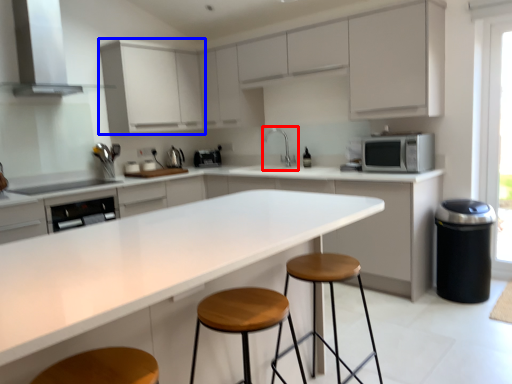
Question: Which object is closer to the camera taking this photo, sink (highlighted by a red box) or cabinetry (highlighted by a blue box)?

Choices:
 (A) sink
 (B) cabinetry

Answer: (B)